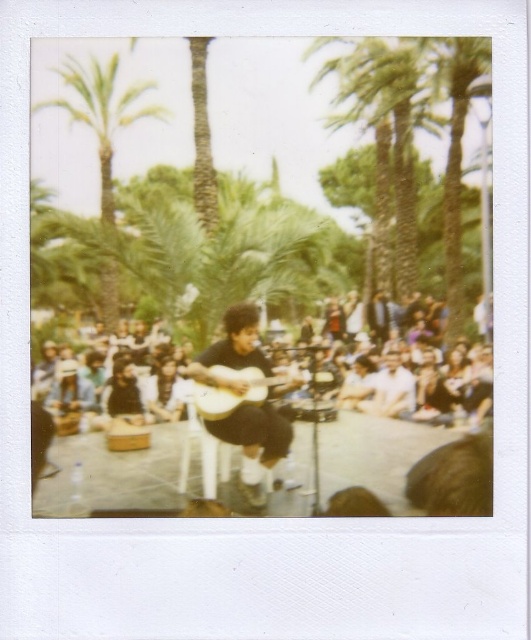
Between matte black guitar at center and wooden acoustic guitar at center, which one has more height?

wooden acoustic guitar at center

Which is more to the left, matte black guitar at center or wooden acoustic guitar at center?

Positioned to the left is wooden acoustic guitar at center.

Locate an element on the screen. matte black guitar at center is located at coordinates (258, 444).

How far apart are matte black guitar at center and green leafy palm tree at upper left?

matte black guitar at center is 17.84 meters away from green leafy palm tree at upper left.

Which is in front, point (261, 451) or point (72, 104)?

Point (261, 451) is in front.

Is point (254, 500) positioned in front of point (104, 152)?

Yes, it is in front of point (104, 152).

You are a GUI agent. You are given a task and a screenshot of the screen. Output one action in this format:
    pyautogui.click(x=<x>, y=<y>)
    Task: Click on the matte black guitar at center
    The height and width of the screenshot is (640, 531).
    Given the screenshot: What is the action you would take?
    pyautogui.click(x=258, y=444)

Who is shorter, green leafy palm tree at upper left or wooden acoustic guitar at center?

wooden acoustic guitar at center is shorter.

Is green leafy palm tree at upper left above wooden acoustic guitar at center?

Yes.

The image size is (531, 640). I want to click on green leafy palm tree at upper left, so click(101, 116).

The height and width of the screenshot is (640, 531). I want to click on green leafy palm tree at upper left, so click(x=101, y=116).